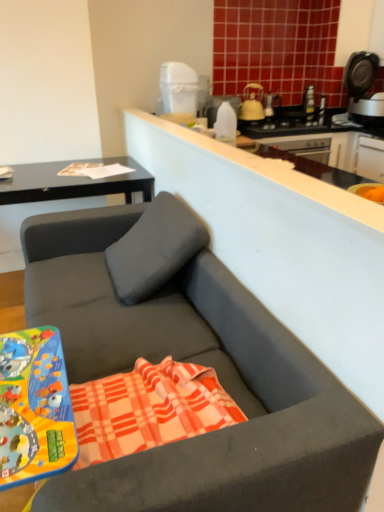
Question: Is plaid cotton beach towel at center located within black plastic coffee machine at upper right?

Choices:
 (A) no
 (B) yes

Answer: (A)

Question: Can you confirm if black plastic coffee machine at upper right is bigger than plaid cotton beach towel at center?

Choices:
 (A) yes
 (B) no

Answer: (A)

Question: Can you confirm if black plastic coffee machine at upper right is shorter than plaid cotton beach towel at center?

Choices:
 (A) yes
 (B) no

Answer: (B)

Question: Does black plastic coffee machine at upper right have a lesser width compared to plaid cotton beach towel at center?

Choices:
 (A) no
 (B) yes

Answer: (A)

Question: From a real-world perspective, is black plastic coffee machine at upper right physically below plaid cotton beach towel at center?

Choices:
 (A) no
 (B) yes

Answer: (A)

Question: Considering their positions, is transparent plastic bottle at upper center located in front of or behind plaid cotton beach towel at center?

Choices:
 (A) behind
 (B) front

Answer: (A)

Question: Based on their sizes in the image, would you say transparent plastic bottle at upper center is bigger or smaller than plaid cotton beach towel at center?

Choices:
 (A) small
 (B) big

Answer: (A)

Question: Does point (213, 132) appear closer or farther from the camera than point (142, 445)?

Choices:
 (A) farther
 (B) closer

Answer: (A)

Question: Would you say transparent plastic bottle at upper center is inside or outside plaid cotton beach towel at center?

Choices:
 (A) outside
 (B) inside

Answer: (A)

Question: In terms of height, does matte black desk at upper left look taller or shorter compared to white plastic trash can at upper center?

Choices:
 (A) short
 (B) tall

Answer: (B)

Question: From a real-world perspective, relative to white plastic trash can at upper center, is matte black desk at upper left vertically above or below?

Choices:
 (A) below
 (B) above

Answer: (A)

Question: In the image, is matte black desk at upper left positioned in front of or behind white plastic trash can at upper center?

Choices:
 (A) front
 (B) behind

Answer: (A)

Question: Choose the correct answer: Is matte black desk at upper left inside white plastic trash can at upper center or outside it?

Choices:
 (A) inside
 (B) outside

Answer: (B)

Question: Does point (163, 72) appear closer or farther from the camera than point (253, 93)?

Choices:
 (A) closer
 (B) farther

Answer: (A)

Question: Is white plastic trash can at upper center spatially inside yellow matte kettle at upper center, or outside of it?

Choices:
 (A) outside
 (B) inside

Answer: (A)